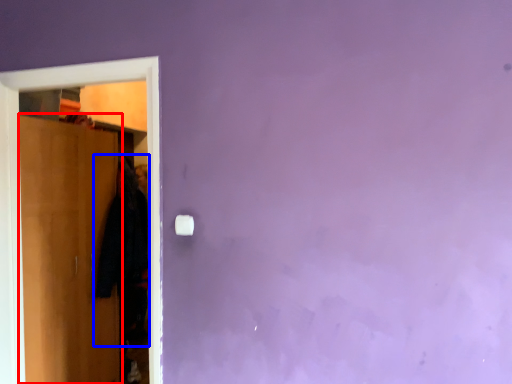
Question: Which object appears closest to the camera in this image, door (highlighted by a red box) or clothing (highlighted by a blue box)?

Choices:
 (A) door
 (B) clothing

Answer: (A)